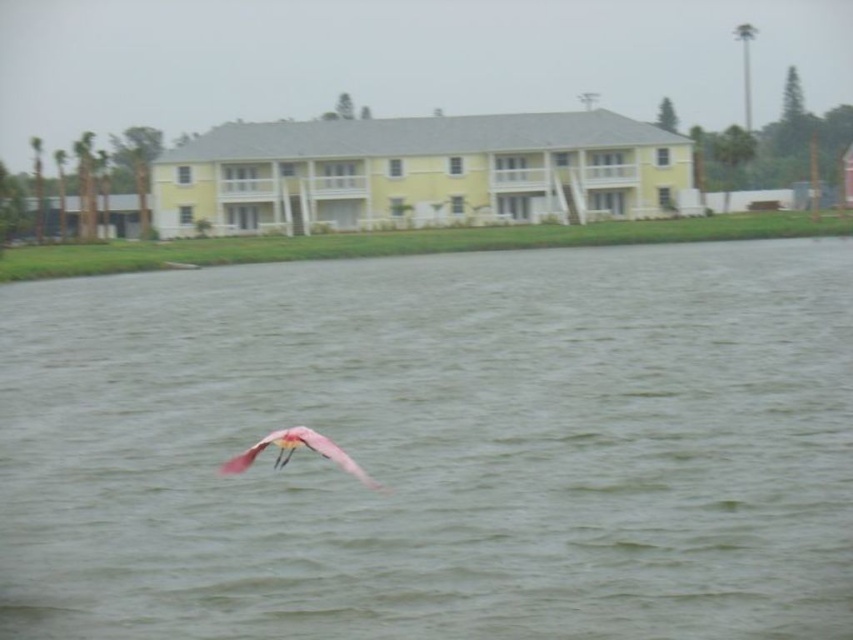
Locate an element on the screen. This screenshot has height=640, width=853. green water at center is located at coordinates (434, 445).

Does green water at center appear on the right side of pink feathered bird at center?

Yes, green water at center is to the right of pink feathered bird at center.

Where is `green water at center`? The width and height of the screenshot is (853, 640). green water at center is located at coordinates (434, 445).